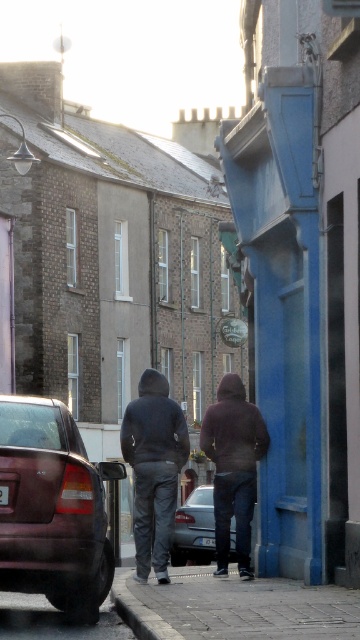
Between point (96, 509) and point (209, 541), which one is positioned behind?

The point (209, 541) is more distant.

Between shiny dark red sedan at left and black plastic license plate at center, which one appears on the right side from the viewer's perspective?

black plastic license plate at center is more to the right.

In order to click on shiny dark red sedan at left in this screenshot , I will do `click(52, 508)`.

You are a GUI agent. You are given a task and a screenshot of the screen. Output one action in this format:
    pyautogui.click(x=<x>, y=<y>)
    Task: Click on the shiny dark red sedan at left
    
    Given the screenshot: What is the action you would take?
    pyautogui.click(x=52, y=508)

Based on the photo, can you confirm if dark brown hoodie at center is positioned below white plastic license plate at center?

Yes.

Who is positioned more to the right, dark brown hoodie at center or white plastic license plate at center?

Positioned to the right is dark brown hoodie at center.

You are a GUI agent. You are given a task and a screenshot of the screen. Output one action in this format:
    pyautogui.click(x=<x>, y=<y>)
    Task: Click on the dark brown hoodie at center
    The width and height of the screenshot is (360, 640).
    Given the screenshot: What is the action you would take?
    pyautogui.click(x=234, y=467)

Who is taller, dark gray hoodie at center or white plastic license plate at center?

dark gray hoodie at center

In the scene shown: Who is more distant from viewer, [163,388] or [0,497]?

The point [163,388] is more distant.

Where is `dark gray hoodie at center`? The width and height of the screenshot is (360, 640). dark gray hoodie at center is located at coordinates (154, 468).